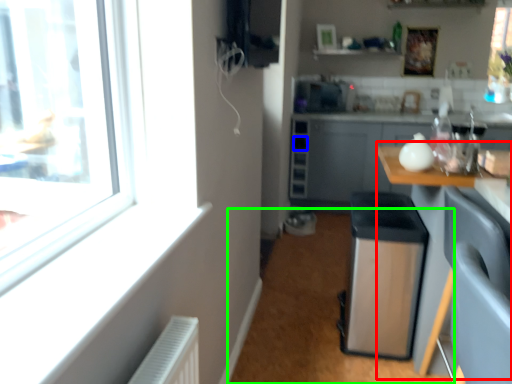
Question: Considering the real-world distances, which object is closest to table (highlighted by a red box)? drawer (highlighted by a blue box) or plain (highlighted by a green box).

Choices:
 (A) drawer
 (B) plain

Answer: (B)